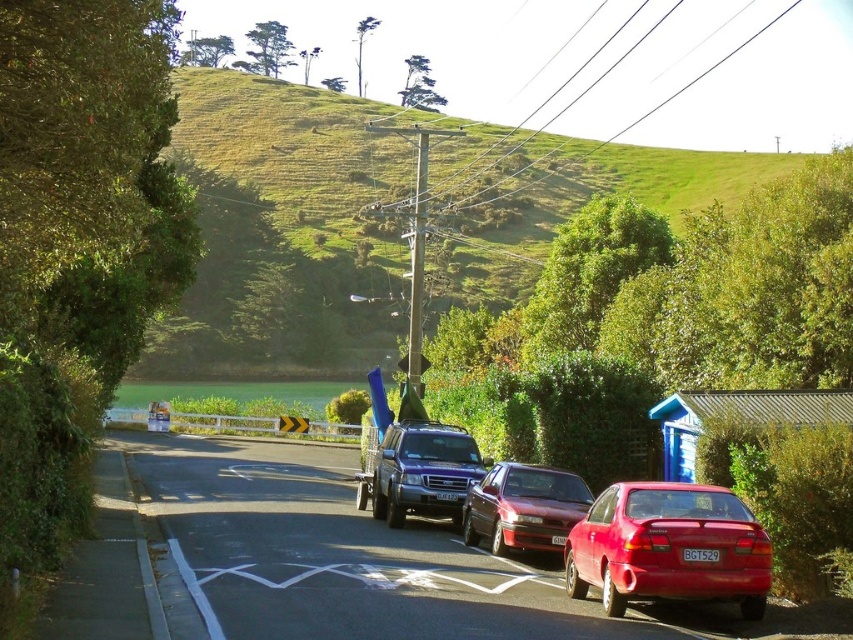
Question: Which object appears closest to the camera in this image?

Choices:
 (A) shiny red sedan at center
 (B) satin black suv at center
 (C) glossy red sedan at lower right
 (D) metallic red car at center

Answer: (D)

Question: Does green grassy hillside at upper center come behind shiny red sedan at center?

Choices:
 (A) no
 (B) yes

Answer: (B)

Question: Does glossy red sedan at lower right come behind shiny red sedan at center?

Choices:
 (A) yes
 (B) no

Answer: (B)

Question: Is metallic red car at center positioned behind glossy red sedan at lower right?

Choices:
 (A) yes
 (B) no

Answer: (B)

Question: Which object is the closest to the shiny red sedan at center?

Choices:
 (A) green grassy hillside at upper center
 (B) satin black suv at center
 (C) glossy red sedan at lower right

Answer: (B)

Question: Which point is farther from the camera taking this photo?

Choices:
 (A) (422, 492)
 (B) (824, 234)
 (C) (355, 620)

Answer: (B)